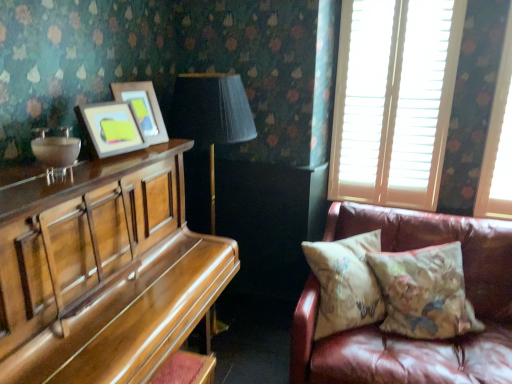
Question: From a real-world perspective, is floral-patterned fabric pillow at right, positioned as the 1th pillow in right-to-left order, physically above white wooden blinds at upper right?

Choices:
 (A) no
 (B) yes

Answer: (A)

Question: Is floral-patterned fabric pillow at right, positioned as the 1th pillow in right-to-left order, facing away from white wooden blinds at upper right?

Choices:
 (A) no
 (B) yes

Answer: (A)

Question: Is white wooden blinds at upper right inside floral-patterned fabric pillow at right, marked as the 2th pillow in a left-to-right arrangement?

Choices:
 (A) no
 (B) yes

Answer: (A)

Question: Does floral-patterned fabric pillow at right, positioned as the 1th pillow in right-to-left order, have a smaller size compared to white wooden blinds at upper right?

Choices:
 (A) no
 (B) yes

Answer: (B)

Question: Considering the relative sizes of floral-patterned fabric pillow at right, positioned as the 1th pillow in right-to-left order, and white wooden blinds at upper right in the image provided, is floral-patterned fabric pillow at right, positioned as the 1th pillow in right-to-left order, taller than white wooden blinds at upper right?

Choices:
 (A) yes
 (B) no

Answer: (B)

Question: From the image's perspective, is floral-patterned fabric pillow at right, positioned as the 1th pillow in right-to-left order, below white wooden blinds at upper right?

Choices:
 (A) yes
 (B) no

Answer: (A)

Question: Does matte wooden picture frame at upper left, positioned as the 1th picture frame in back-to-front order, have a greater width compared to shiny brown piano at left?

Choices:
 (A) yes
 (B) no

Answer: (B)

Question: Is matte wooden picture frame at upper left, positioned as the 1th picture frame in back-to-front order, oriented towards shiny brown piano at left?

Choices:
 (A) no
 (B) yes

Answer: (A)

Question: Can you confirm if matte wooden picture frame at upper left, positioned as the 1th picture frame in back-to-front order, is thinner than shiny brown piano at left?

Choices:
 (A) yes
 (B) no

Answer: (A)

Question: Are matte wooden picture frame at upper left, positioned as the 1th picture frame in back-to-front order, and shiny brown piano at left far apart?

Choices:
 (A) no
 (B) yes

Answer: (A)

Question: Can we say matte wooden picture frame at upper left, positioned as the 1th picture frame in back-to-front order, lies outside shiny brown piano at left?

Choices:
 (A) yes
 (B) no

Answer: (A)

Question: Is matte wooden picture frame at upper left, the second picture frame in the front-to-back sequence, next to shiny brown piano at left and touching it?

Choices:
 (A) yes
 (B) no

Answer: (B)

Question: Is matte wooden picture frame at upper left, positioned as the 1th picture frame in back-to-front order, outside of white wooden blinds at upper right?

Choices:
 (A) no
 (B) yes

Answer: (B)